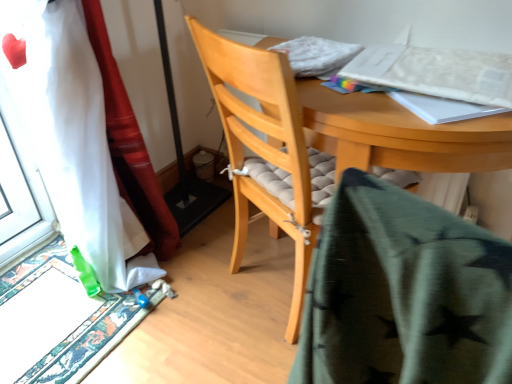
Question: In the image, is white paper at upper right positioned in front of or behind white sheer curtain at left?

Choices:
 (A) front
 (B) behind

Answer: (B)

Question: In terms of height, does white paper at upper right look taller or shorter compared to white sheer curtain at left?

Choices:
 (A) short
 (B) tall

Answer: (A)

Question: Estimate the real-world distances between objects in this image. Which object is farther from the light wood chair at center?

Choices:
 (A) white paper at upper right
 (B) carpeted doormat at lower left
 (C) white sheer curtain at left
 (D) green star-patterned fabric at center

Answer: (B)

Question: Which of these objects is positioned closest to the green star-patterned fabric at center?

Choices:
 (A) white paper at upper right
 (B) carpeted doormat at lower left
 (C) light wood chair at center
 (D) white sheer curtain at left

Answer: (C)